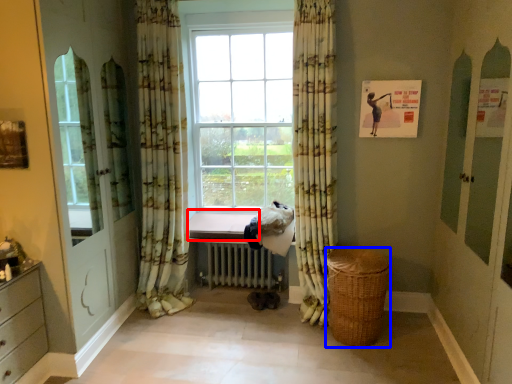
Question: Which object is closer to the camera taking this photo, window sill (highlighted by a red box) or basket (highlighted by a blue box)?

Choices:
 (A) window sill
 (B) basket

Answer: (B)